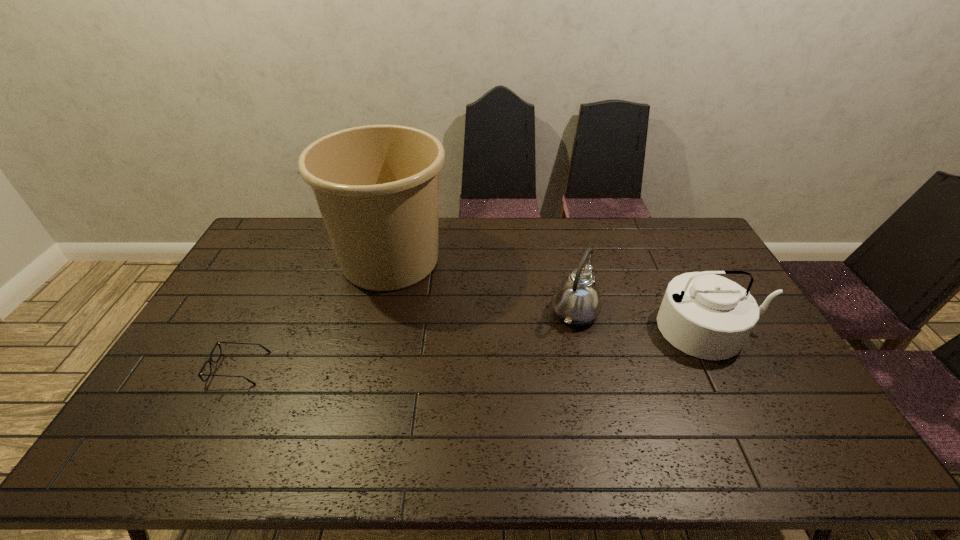
This screenshot has height=540, width=960. I want to click on object that is the third closest to the left kettle, so click(210, 360).

At what (x,y) coordinates should I click in order to perform the action: click on vacant region that satisfies the following two spatial constraints: 1. on the spout of the right kettle; 2. with the lenses facing outward on the leftmost object. Please return your answer as a coordinate pair (x, y). This screenshot has height=540, width=960. Looking at the image, I should click on (730, 368).

Identify the location of vacant point that satisfies the following two spatial constraints: 1. on the front side of the third object from left to right; 2. on the right side of the tallest object. (376, 312).

I want to click on free space that satisfies the following two spatial constraints: 1. on the front side of the bucket; 2. with the lenses facing outward on the spectacles, so click(363, 368).

You are a GUI agent. You are given a task and a screenshot of the screen. Output one action in this format:
    pyautogui.click(x=<x>, y=<y>)
    Task: Click on the vacant position in the image that satisfies the following two spatial constraints: 1. on the front side of the bucket; 2. with the lenses facing outward on the spectacles
    
    Given the screenshot: What is the action you would take?
    pyautogui.click(x=363, y=368)

This screenshot has width=960, height=540. Find the location of `vacant point that satisfies the following two spatial constraints: 1. on the front side of the second object from right to left; 2. with the lenses facing outward on the spectacles`. vacant point that satisfies the following two spatial constraints: 1. on the front side of the second object from right to left; 2. with the lenses facing outward on the spectacles is located at coordinates (588, 368).